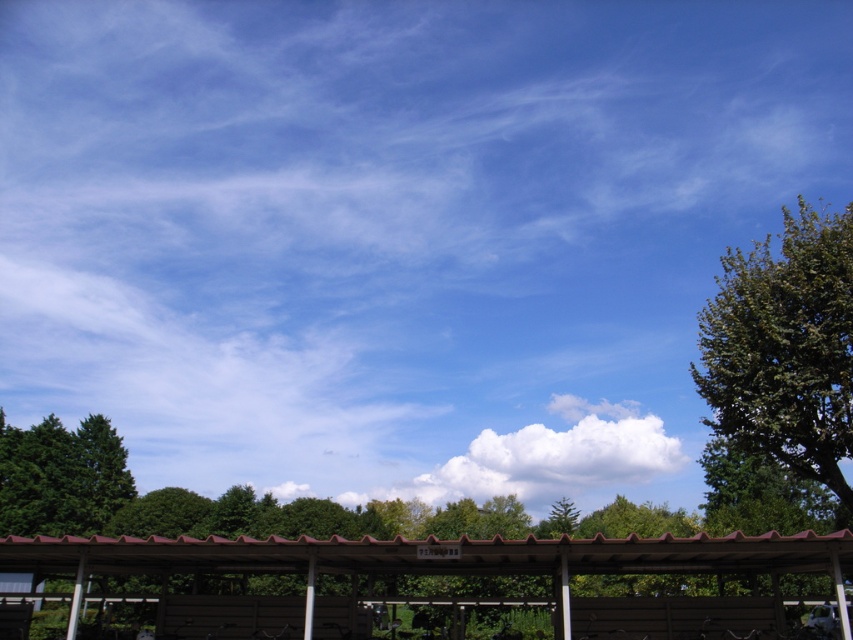
Question: Can you confirm if white fluffy cloud at center is thinner than green matte tree at lower left?

Choices:
 (A) yes
 (B) no

Answer: (B)

Question: Is green leafy tree at right above green matte tree at lower left?

Choices:
 (A) yes
 (B) no

Answer: (A)

Question: From the image, what is the correct spatial relationship of brown corrugated metal shelter at center in relation to green matte tree at lower left?

Choices:
 (A) left
 (B) right

Answer: (B)

Question: Which point appears closest to the camera in this image?

Choices:
 (A) (422, 486)
 (B) (39, 452)

Answer: (B)

Question: Among these points, which one is nearest to the camera?

Choices:
 (A) (560, 465)
 (B) (819, 397)

Answer: (B)

Question: Which object appears closest to the camera in this image?

Choices:
 (A) green leafy tree at right
 (B) brown corrugated metal shelter at center
 (C) green matte tree at lower left
 (D) white fluffy cloud at center

Answer: (B)